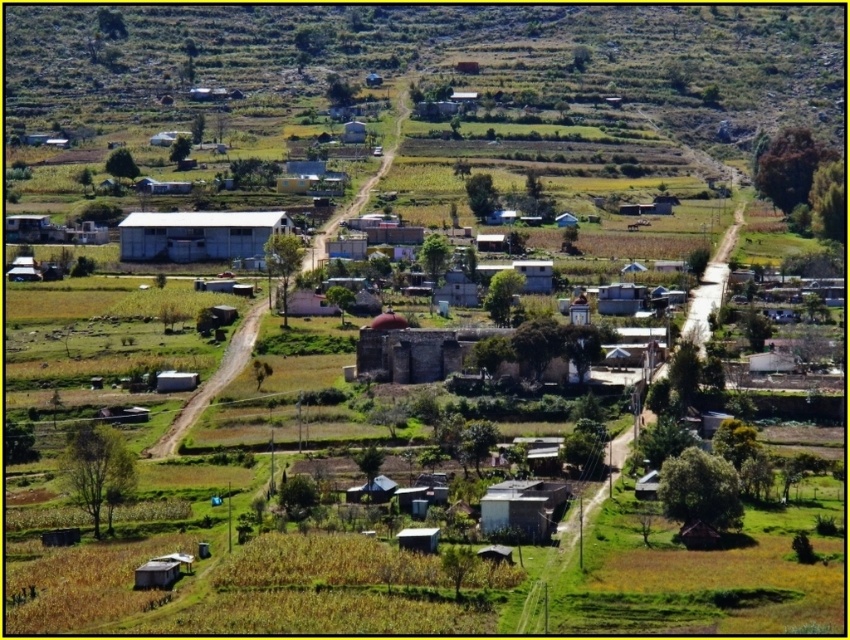
Question: Which of the following is the farthest from the observer?

Choices:
 (A) white matte hut at center
 (B) white corrugated metal building at center

Answer: (B)

Question: Which point is farther to the camera?

Choices:
 (A) white matte hut at center
 (B) white corrugated metal building at center

Answer: (B)

Question: Does white corrugated metal building at center appear over white matte hut at center?

Choices:
 (A) no
 (B) yes

Answer: (B)

Question: Among these objects, which one is nearest to the camera?

Choices:
 (A) white corrugated metal building at center
 (B) white matte hut at center

Answer: (B)

Question: Can you confirm if white corrugated metal building at center is positioned to the left of white matte hut at center?

Choices:
 (A) yes
 (B) no

Answer: (A)

Question: Can you confirm if white corrugated metal building at center is positioned below white matte hut at center?

Choices:
 (A) no
 (B) yes

Answer: (A)